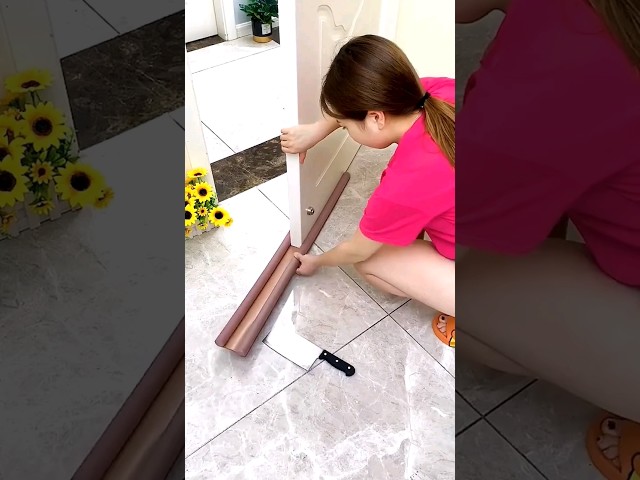
At what (x,y) coordinates should I click in order to perform the action: click on gray floor tiles. Please return your answer as a coordinate pair (x, y). Looking at the image, I should click on (384, 413), (324, 304), (335, 224), (419, 319).